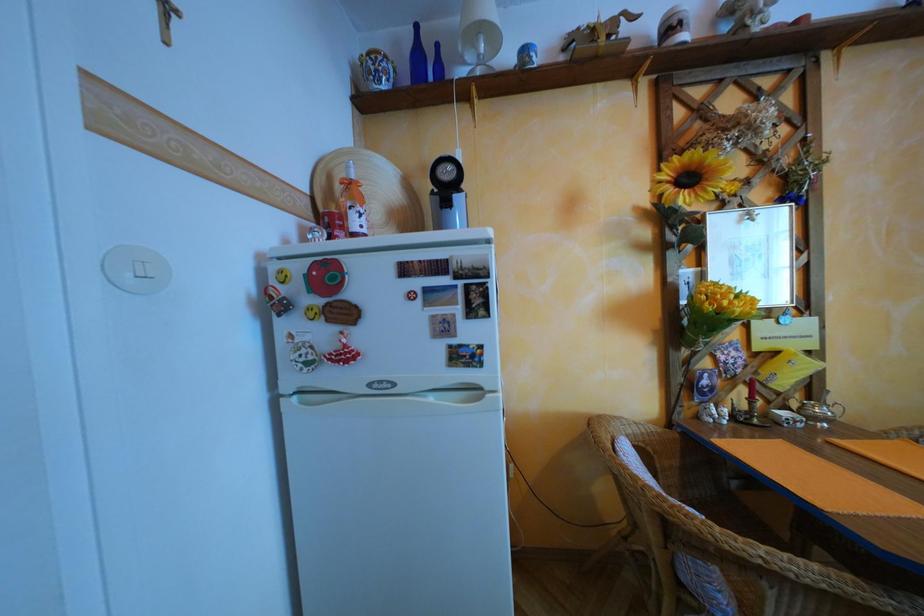
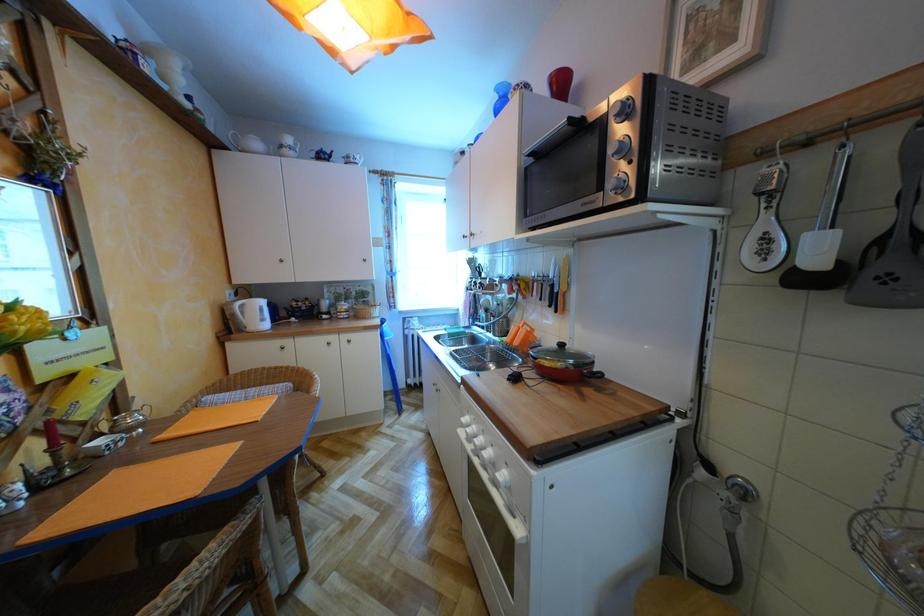
Question: The camera is either moving clockwise (left) or counter-clockwise (right) around the object. The first image is from the beginning of the video and the second image is from the end. Is the camera moving left or right when shooting the video?

Choices:
 (A) Left
 (B) Right

Answer: (A)